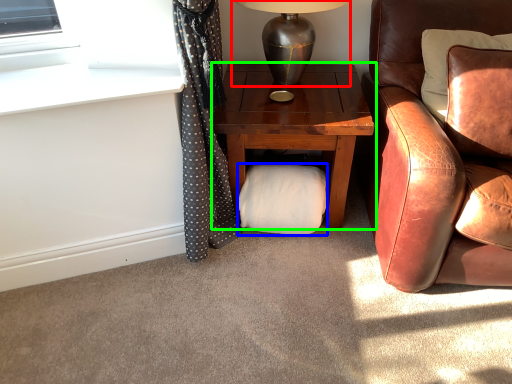
Question: Considering the real-world distances, which object is farthest from table lamp (highlighted by a red box)? material (highlighted by a blue box) or nightstand (highlighted by a green box)?

Choices:
 (A) material
 (B) nightstand

Answer: (A)